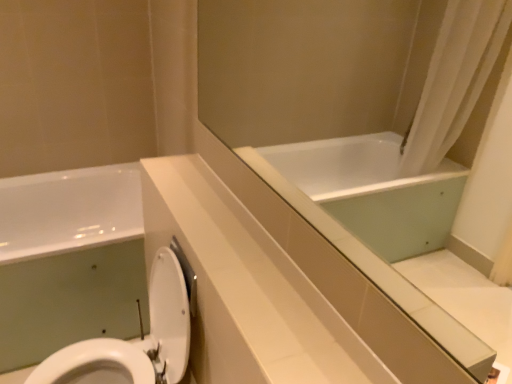
Question: Considering the relative sizes of white glossy toilet at lower left and white glossy bathtub at lower left in the image provided, is white glossy toilet at lower left smaller than white glossy bathtub at lower left?

Choices:
 (A) yes
 (B) no

Answer: (A)

Question: Is white glossy toilet at lower left positioned with its back to white glossy bathtub at lower left?

Choices:
 (A) no
 (B) yes

Answer: (A)

Question: From the image's perspective, would you say white glossy toilet at lower left is positioned over white glossy bathtub at lower left?

Choices:
 (A) yes
 (B) no

Answer: (B)

Question: Is white glossy toilet at lower left behind white glossy bathtub at lower left?

Choices:
 (A) no
 (B) yes

Answer: (A)

Question: Could you tell me if white glossy toilet at lower left is turned towards white glossy bathtub at lower left?

Choices:
 (A) yes
 (B) no

Answer: (B)

Question: Is white glossy toilet at lower left positioned beyond the bounds of white glossy bathtub at lower left?

Choices:
 (A) no
 (B) yes

Answer: (B)

Question: From a real-world perspective, is white glossy bathtub at lower left positioned under white glossy counter top at center based on gravity?

Choices:
 (A) no
 (B) yes

Answer: (B)

Question: Is white glossy bathtub at lower left turned away from white glossy counter top at center?

Choices:
 (A) no
 (B) yes

Answer: (A)

Question: Considering the relative sizes of white glossy bathtub at lower left and white glossy counter top at center in the image provided, is white glossy bathtub at lower left taller than white glossy counter top at center?

Choices:
 (A) yes
 (B) no

Answer: (A)

Question: Is white glossy bathtub at lower left at the left side of white glossy counter top at center?

Choices:
 (A) yes
 (B) no

Answer: (A)

Question: Is white glossy bathtub at lower left not inside white glossy counter top at center?

Choices:
 (A) yes
 (B) no

Answer: (A)

Question: Is white glossy counter top at center located within white glossy bathtub at lower left?

Choices:
 (A) no
 (B) yes

Answer: (A)

Question: Does white glossy toilet at lower left lie in front of white glossy counter top at center?

Choices:
 (A) yes
 (B) no

Answer: (B)